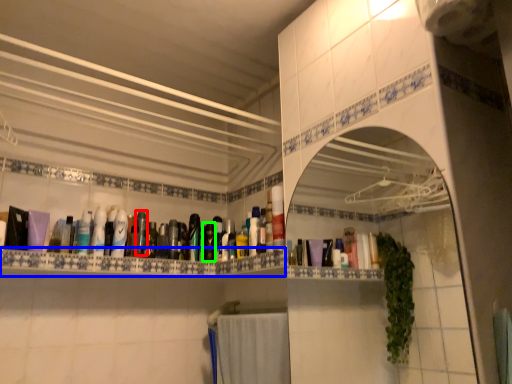
Question: Which is farther away from toiletry (highlighted by a red box)? ledge (highlighted by a blue box) or toiletry (highlighted by a green box)?

Choices:
 (A) ledge
 (B) toiletry

Answer: (A)